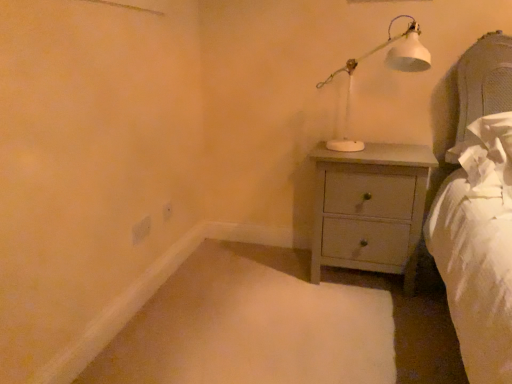
Question: Does white matte electric outlet at lower left, acting as the second electric outlet starting from the right, have a lesser width compared to white matte table lamp at upper right?

Choices:
 (A) no
 (B) yes

Answer: (B)

Question: From a real-world perspective, is white matte electric outlet at lower left, which is counted as the first electric outlet, starting from the left, positioned over white matte table lamp at upper right based on gravity?

Choices:
 (A) yes
 (B) no

Answer: (B)

Question: From a real-world perspective, is white matte electric outlet at lower left, acting as the first electric outlet starting from the front, beneath white matte table lamp at upper right?

Choices:
 (A) yes
 (B) no

Answer: (A)

Question: Considering the relative positions of white matte electric outlet at lower left, which is counted as the first electric outlet, starting from the left, and white matte table lamp at upper right in the image provided, is white matte electric outlet at lower left, which is counted as the first electric outlet, starting from the left, to the right of white matte table lamp at upper right from the viewer's perspective?

Choices:
 (A) yes
 (B) no

Answer: (B)

Question: Does white matte electric outlet at lower left, marked as the second electric outlet in a back-to-front arrangement, have a greater width compared to white matte table lamp at upper right?

Choices:
 (A) yes
 (B) no

Answer: (B)

Question: In terms of width, does white matte electric outlet at lower left, marked as the second electric outlet in a back-to-front arrangement, look wider or thinner when compared to white plastic electric outlet at lower center, placed as the 2th electric outlet when sorted from left to right?

Choices:
 (A) thin
 (B) wide

Answer: (B)

Question: Considering the positions of white matte electric outlet at lower left, marked as the second electric outlet in a back-to-front arrangement, and white plastic electric outlet at lower center, placed as the 2th electric outlet when sorted from left to right, in the image, is white matte electric outlet at lower left, marked as the second electric outlet in a back-to-front arrangement, taller or shorter than white plastic electric outlet at lower center, placed as the 2th electric outlet when sorted from left to right,?

Choices:
 (A) short
 (B) tall

Answer: (A)

Question: Relative to white plastic electric outlet at lower center, the 1th electric outlet viewed from the right, is white matte electric outlet at lower left, marked as the second electric outlet in a back-to-front arrangement, in front or behind?

Choices:
 (A) front
 (B) behind

Answer: (A)

Question: From a real-world perspective, is white matte electric outlet at lower left, marked as the second electric outlet in a back-to-front arrangement, positioned above or below white plastic electric outlet at lower center, placed as the 2th electric outlet when sorted from left to right?

Choices:
 (A) above
 (B) below

Answer: (A)

Question: From the image's perspective, is white matte table lamp at upper right positioned above or below white plastic electric outlet at lower center, which is the second electric outlet in front-to-back order?

Choices:
 (A) above
 (B) below

Answer: (A)

Question: In terms of height, does white matte table lamp at upper right look taller or shorter compared to white plastic electric outlet at lower center, the 1th electric outlet viewed from the right?

Choices:
 (A) tall
 (B) short

Answer: (A)

Question: Based on their positions, is white matte table lamp at upper right located to the left or right of white plastic electric outlet at lower center, the 1th electric outlet from the back?

Choices:
 (A) left
 (B) right

Answer: (B)

Question: Considering the positions of white matte table lamp at upper right and white plastic electric outlet at lower center, the 1th electric outlet from the back, in the image, is white matte table lamp at upper right wider or thinner than white plastic electric outlet at lower center, the 1th electric outlet from the back,?

Choices:
 (A) thin
 (B) wide

Answer: (B)

Question: Which is correct: white matte table lamp at upper right is inside light gray wood chest of drawers at center-right, or outside of it?

Choices:
 (A) inside
 (B) outside

Answer: (B)

Question: From the image's perspective, is white matte table lamp at upper right above or below light gray wood chest of drawers at center-right?

Choices:
 (A) above
 (B) below

Answer: (A)